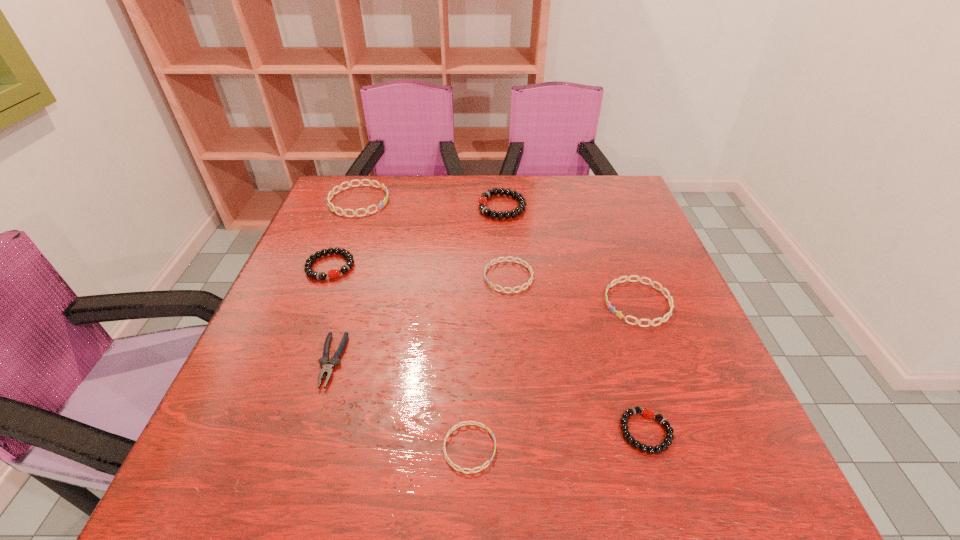
In the image, there is a desktop. Where is `vacant space at the near edge`? The height and width of the screenshot is (540, 960). vacant space at the near edge is located at coordinates (466, 480).

You are a GUI agent. You are given a task and a screenshot of the screen. Output one action in this format:
    pyautogui.click(x=<x>, y=<y>)
    Task: Click on the vacant area at the right edge
    The image size is (960, 540).
    Given the screenshot: What is the action you would take?
    pyautogui.click(x=628, y=313)

At what (x,y) coordinates should I click in order to perform the action: click on free space at the far left corner of the desktop. Please return your answer as a coordinate pair (x, y). The width and height of the screenshot is (960, 540). Looking at the image, I should click on (348, 177).

Image resolution: width=960 pixels, height=540 pixels. In the image, there is a desktop. What are the coordinates of `vacant space at the near left corner` in the screenshot? It's located at coord(209,497).

I want to click on vacant position at the far right corner of the desktop, so click(x=628, y=187).

I want to click on free spot between the shortest bracelet and the second smallest black bracelet, so click(400, 357).

This screenshot has height=540, width=960. What are the coordinates of `free space between the pliers and the third biggest blue bracelet` in the screenshot? It's located at (420, 319).

Identify the location of free space between the second smallest blue bracelet and the nearest blue bracelet. The image size is (960, 540). (489, 362).

Locate an element on the screen. The height and width of the screenshot is (540, 960). empty space that is in between the gray pliers and the third biggest blue bracelet is located at coordinates (420, 319).

This screenshot has height=540, width=960. What are the coordinates of `free space between the leftmost black bracelet and the second black bracelet from left to right` in the screenshot? It's located at (416, 237).